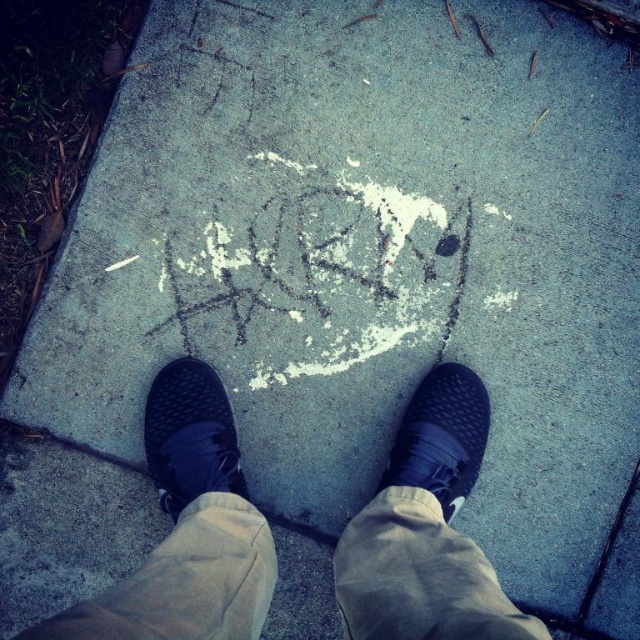
Based on the scene described, can you determine if the white chalk writing at center is wider than the black rubber crack at lower right?

The white chalk writing at center might be wider than black rubber crack at lower right according to the description.

You are standing on the sidewalk and see the white chalk writing at center. If you want to step on it, where should you place your foot relative to the writing?

The white chalk writing at center is located at point 0.498 on the horizontal axis, so you should place your foot directly over that point to step on it.